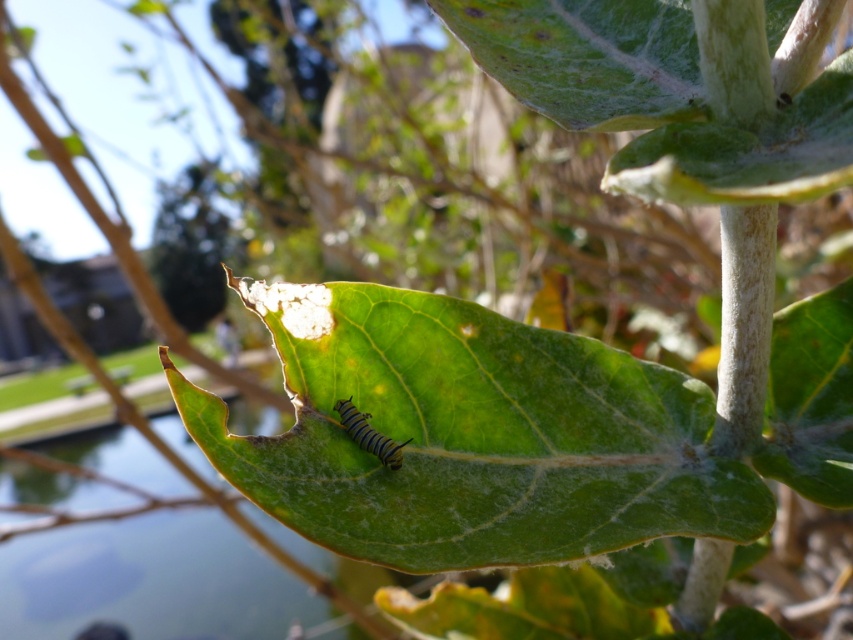
Is point (473, 317) less distant than point (338, 410)?

That is False.

Who is positioned more to the left, green matte leaf at center or yellow striped caterpillar at center?

yellow striped caterpillar at center

Who is more forward, (647, 508) or (360, 442)?

Point (647, 508) is more forward.

Locate an element on the screen. green matte leaf at center is located at coordinates (473, 435).